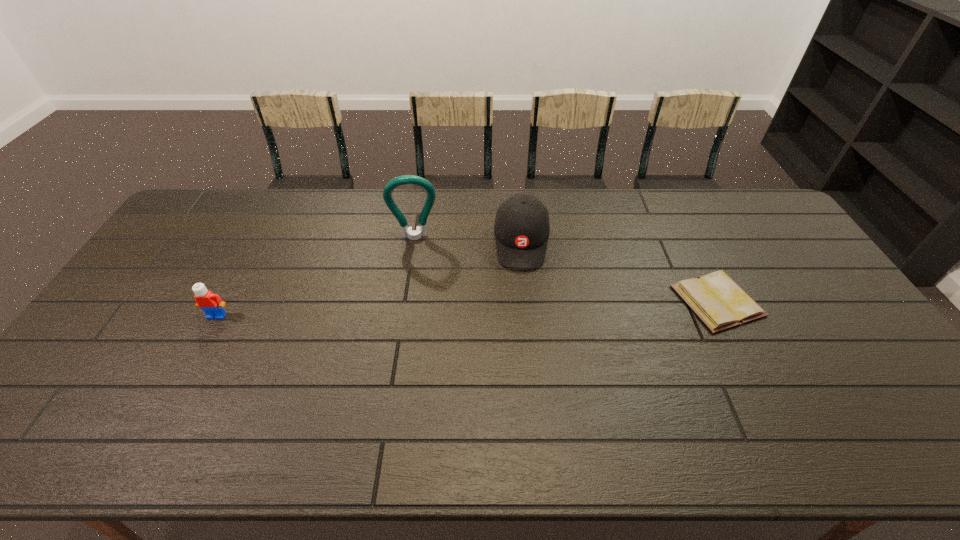
Where is `free spot located 0.140m at the jaws of the third object from right to left`? The image size is (960, 540). free spot located 0.140m at the jaws of the third object from right to left is located at coordinates (417, 274).

You are a GUI agent. You are given a task and a screenshot of the screen. Output one action in this format:
    pyautogui.click(x=<x>, y=<y>)
    Task: Click on the free space located 0.310m with a logo on the front of the baseball cap
    
    Given the screenshot: What is the action you would take?
    pyautogui.click(x=522, y=356)

Locate an element on the screen. vacant space located with a logo on the front of the baseball cap is located at coordinates (522, 359).

Locate an element on the screen. The image size is (960, 540). free space located 0.180m with a logo on the front of the baseball cap is located at coordinates (522, 317).

This screenshot has width=960, height=540. In order to click on object positioned at the far edge in this screenshot , I will do `click(522, 227)`.

This screenshot has width=960, height=540. In order to click on vacant space at the far edge in this screenshot , I will do `click(539, 194)`.

This screenshot has width=960, height=540. I want to click on vacant space at the near edge, so click(546, 389).

In the image, there is a desktop. At what (x,y) coordinates should I click in order to perform the action: click on blank space at the right edge. Please return your answer as a coordinate pair (x, y). This screenshot has height=540, width=960. Looking at the image, I should click on (815, 307).

This screenshot has width=960, height=540. In the image, there is a desktop. In order to click on vacant region at the far left corner in this screenshot , I will do `click(234, 207)`.

The image size is (960, 540). In the image, there is a desktop. What are the coordinates of `vacant space at the far right corner` in the screenshot? It's located at (731, 200).